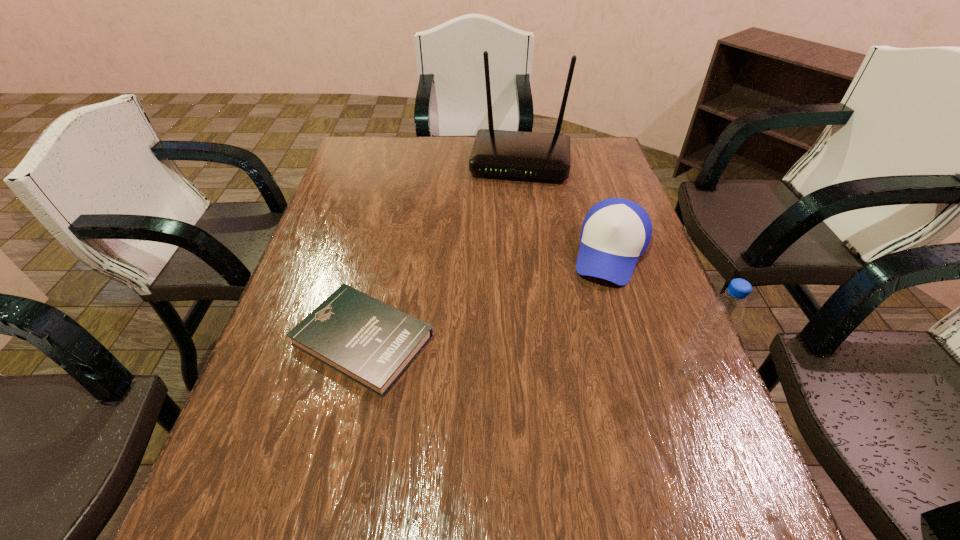
Identify the location of object that is positioned at the far right corner. (533, 155).

Locate an element on the screen. free region at the far edge is located at coordinates 400,155.

You are a GUI agent. You are given a task and a screenshot of the screen. Output one action in this format:
    pyautogui.click(x=<x>, y=<y>)
    Task: Click on the vacant region at the near edge
    The width and height of the screenshot is (960, 540).
    Given the screenshot: What is the action you would take?
    pyautogui.click(x=372, y=427)

Locate an element on the screen. The image size is (960, 540). vacant space at the left edge is located at coordinates point(348,200).

I want to click on vacant space at the right edge of the desktop, so click(x=652, y=252).

Where is `free spot at the far left corner of the desktop`? This screenshot has height=540, width=960. free spot at the far left corner of the desktop is located at coordinates pos(357,152).

This screenshot has height=540, width=960. Identify the location of vacant space at the far right corner. (610, 171).

You are a GUI agent. You are given a task and a screenshot of the screen. Output one action in this format:
    pyautogui.click(x=<x>, y=<y>)
    Task: Click on the vacant point located between the farthest object and the book
    This screenshot has height=540, width=960.
    Given the screenshot: What is the action you would take?
    442,251

Where is `free area in between the third shortest object and the baseball cap`? This screenshot has width=960, height=540. free area in between the third shortest object and the baseball cap is located at coordinates (652, 311).

Identify the location of unoccupied position between the third shortest object and the third nearest object. The height and width of the screenshot is (540, 960). (652, 311).